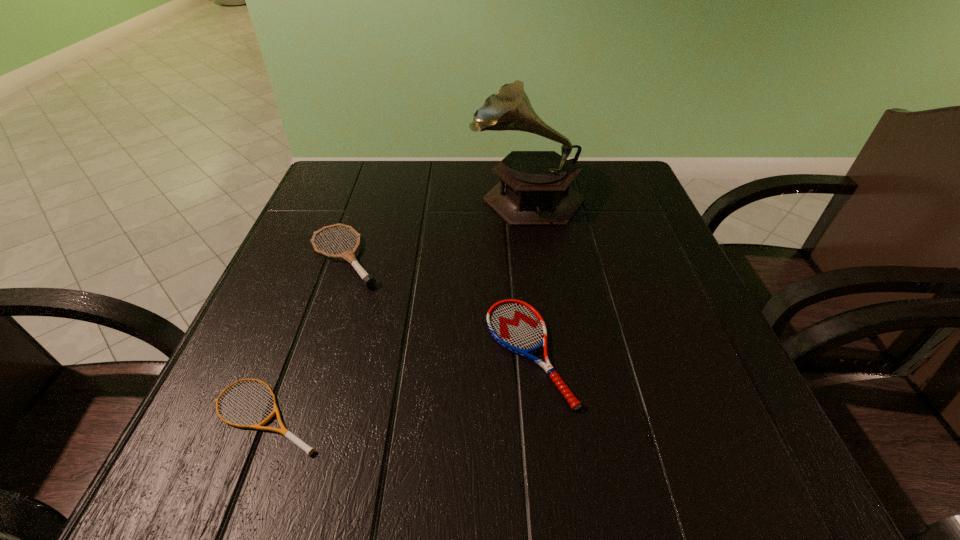
This screenshot has width=960, height=540. What are the coordinates of `vacant space located on the right of the tallest tennis racket` in the screenshot? It's located at (414, 257).

Locate an element on the screen. The image size is (960, 540). free space located on the front of the rightmost tennis racket is located at coordinates (542, 491).

Locate an element on the screen. Image resolution: width=960 pixels, height=540 pixels. vacant area situated 0.260m on the right of the shortest tennis racket is located at coordinates (506, 413).

You are a GUI agent. You are given a task and a screenshot of the screen. Output one action in this format:
    pyautogui.click(x=<x>, y=<y>)
    Task: Click on the object at the far edge
    This screenshot has height=540, width=960.
    Given the screenshot: What is the action you would take?
    pyautogui.click(x=534, y=189)

The height and width of the screenshot is (540, 960). In order to click on object present at the near edge in this screenshot , I will do `click(286, 433)`.

The image size is (960, 540). I want to click on object positioned at the right edge, so click(534, 189).

You are a GUI agent. You are given a task and a screenshot of the screen. Output one action in this format:
    pyautogui.click(x=<x>, y=<y>)
    Task: Click on the object that is at the near left corner
    
    Given the screenshot: What is the action you would take?
    pyautogui.click(x=286, y=433)

What are the coordinates of `object at the far right corner` in the screenshot? It's located at (534, 189).

In the image, there is a desktop. Where is `free space at the left edge`? free space at the left edge is located at coordinates 324,386.

Identify the location of vacant region at the right edge of the desktop. This screenshot has width=960, height=540. pyautogui.click(x=620, y=266).